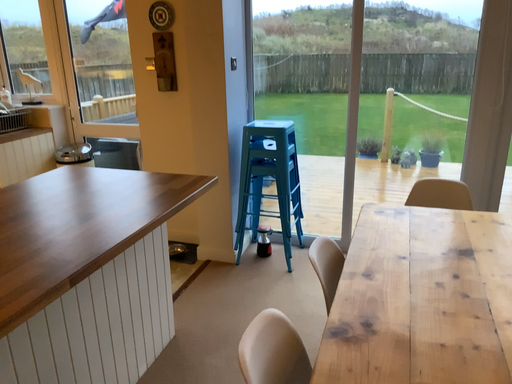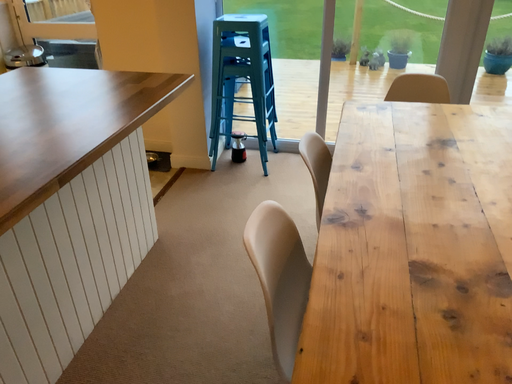
Question: Which way did the camera rotate in the video?

Choices:
 (A) rotated downward
 (B) rotated upward

Answer: (A)